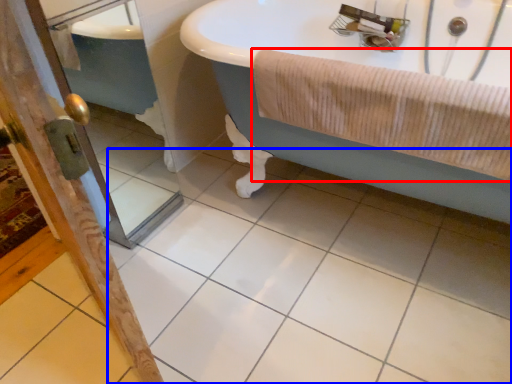
Question: Which point is closer to the camera, bath towel (highlighted by a red box) or ceramic tile (highlighted by a blue box)?

Choices:
 (A) bath towel
 (B) ceramic tile

Answer: (B)